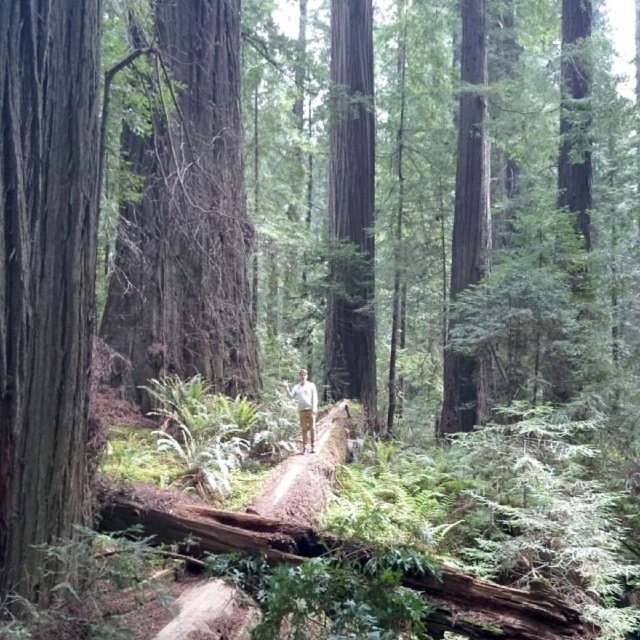
Who is taller, smooth brown tree trunk at left or brown dirt trail at center?

With more height is smooth brown tree trunk at left.

Is the position of smooth brown tree trunk at left less distant than that of brown dirt trail at center?

Yes, smooth brown tree trunk at left is closer to the viewer.

Locate an element on the screen. smooth brown tree trunk at left is located at coordinates (45, 272).

At what (x,y) coordinates should I click in order to perform the action: click on smooth brown tree trunk at left. Please return your answer as a coordinate pair (x, y). The height and width of the screenshot is (640, 640). Looking at the image, I should click on (45, 272).

Can you confirm if smooth dark brown tree trunk at center is wider than brown dirt trail at center?

Incorrect, smooth dark brown tree trunk at center's width does not surpass brown dirt trail at center's.

Image resolution: width=640 pixels, height=640 pixels. Describe the element at coordinates (349, 209) in the screenshot. I see `smooth dark brown tree trunk at center` at that location.

Does point (353, 385) come farther from viewer compared to point (296, 492)?

That is True.

Where is `smooth dark brown tree trunk at center`? smooth dark brown tree trunk at center is located at coordinates point(349,209).

Does brown dirt trail at center have a smaller size compared to white cotton shirt at center?

Incorrect, brown dirt trail at center is not smaller in size than white cotton shirt at center.

Is brown dirt trail at center in front of white cotton shirt at center?

Yes, it is in front of white cotton shirt at center.

Who is more forward, (x=248, y=512) or (x=305, y=410)?

Positioned in front is point (x=248, y=512).

Identify the location of brown dirt trail at center. (305, 472).